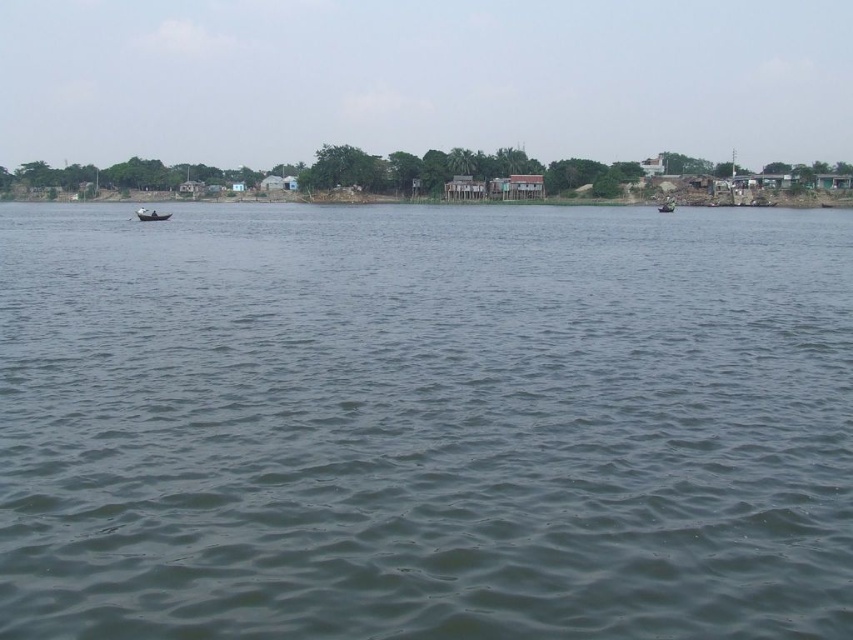
You are planning to carry a heavy load across the water. Which boat, the wooden boat at left or the green plastic boat at right, would you choose based on their widths?

The green plastic boat at right is wider than the wooden boat at left, so it can carry heavier loads more safely.

You are standing on the shore and see the wooden boat at left and the green plastic boat at right. Which boat is shorter in height?

The wooden boat at left is not as tall as the green plastic boat at right, so the wooden boat at left is shorter in height.